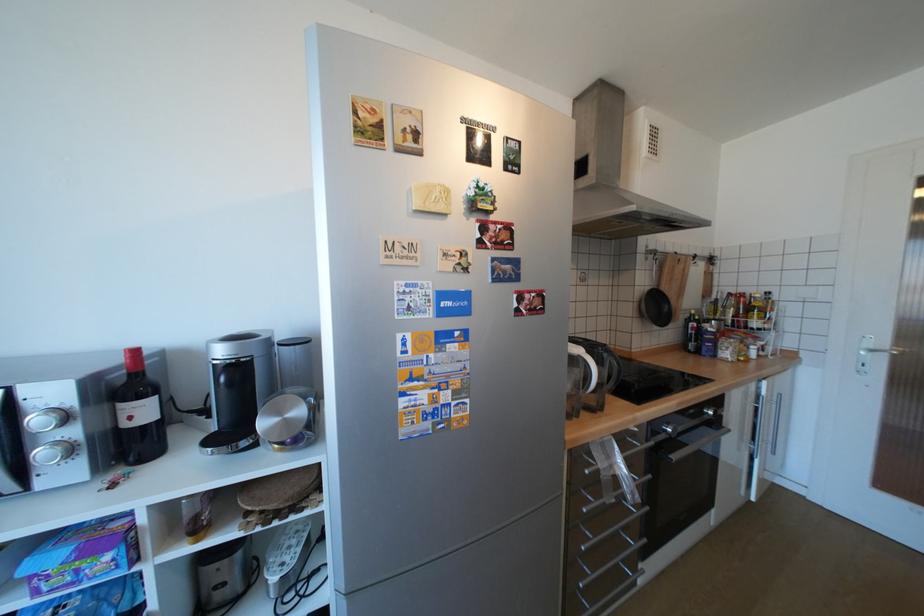
Find where to push the silver door handle. Please return your answer as a coordinate pair (x, y).

(882, 351)